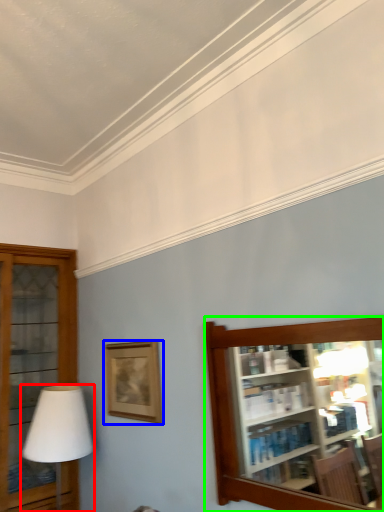
Question: Which is nearer to the table lamp (highlighted by a red box)? picture frame (highlighted by a blue box) or shelf (highlighted by a green box).

Choices:
 (A) picture frame
 (B) shelf

Answer: (A)